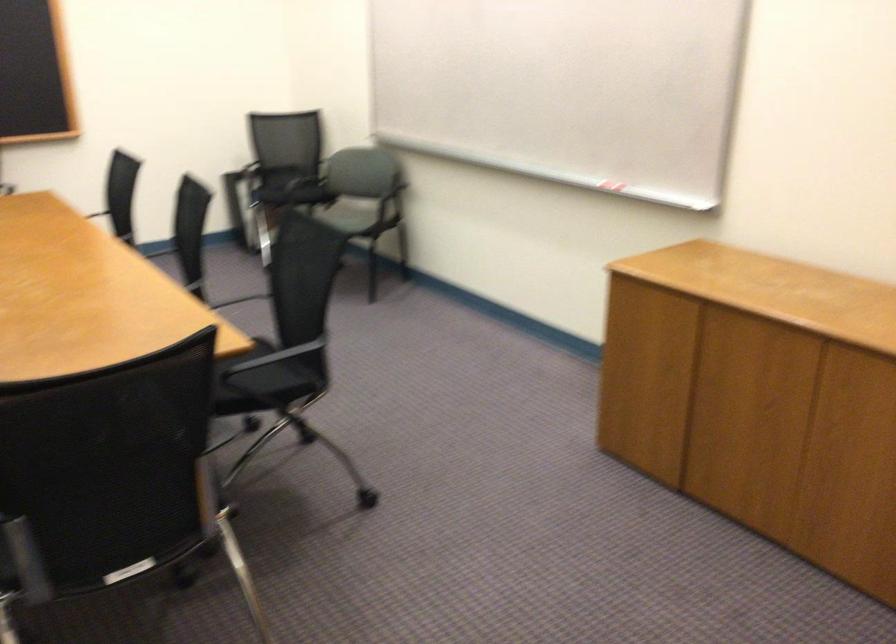
Identify the location of whiteboard marker tray. (506, 169).